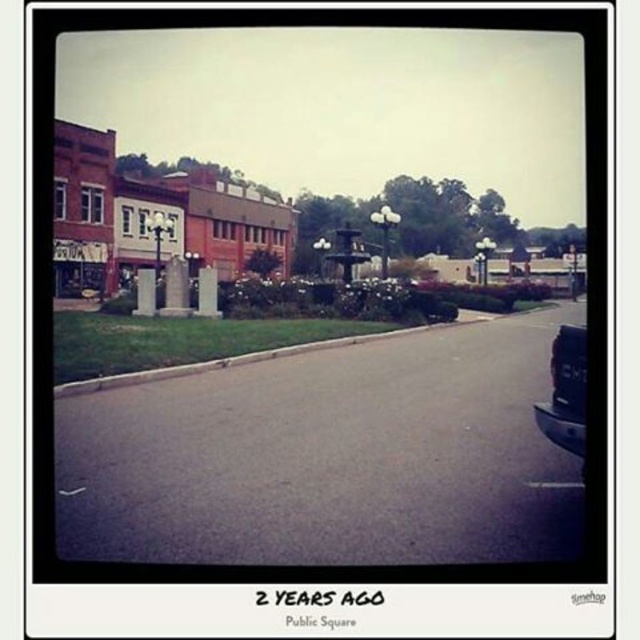
Question: Is brick building at left positioned before black matte truck at right?

Choices:
 (A) no
 (B) yes

Answer: (A)

Question: Estimate the real-world distances between objects in this image. Which object is closer to the brick building at left?

Choices:
 (A) gray concrete curb at lower center
 (B) black matte truck at right

Answer: (A)

Question: Which of the following is the farthest from the observer?

Choices:
 (A) (113, 388)
 (B) (576, 420)
 (C) (237, 272)

Answer: (C)

Question: Is brick building at left further to the viewer compared to gray concrete curb at lower center?

Choices:
 (A) yes
 (B) no

Answer: (A)

Question: Which point is closer to the camera?

Choices:
 (A) (432, 324)
 (B) (65, 196)
 (C) (579, 378)

Answer: (C)

Question: Does black matte truck at right lie in front of gray concrete curb at lower center?

Choices:
 (A) no
 (B) yes

Answer: (B)